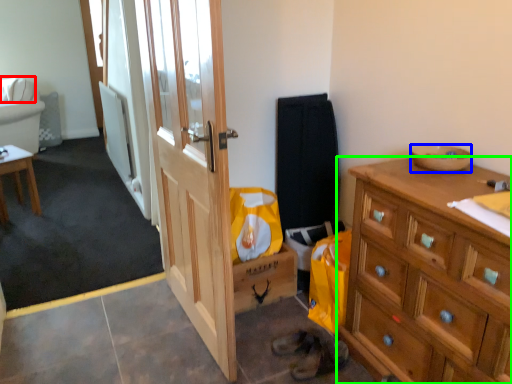
Question: Which object is the closest to the pillow (highlighted by a red box)? Choose among these: bowl (highlighted by a blue box) or cabinetry (highlighted by a green box).

Choices:
 (A) bowl
 (B) cabinetry

Answer: (A)